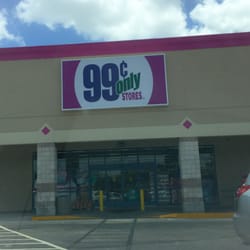
Identify the location of yellow circles on door. This screenshot has height=250, width=250. tap(113, 179), tap(131, 179).